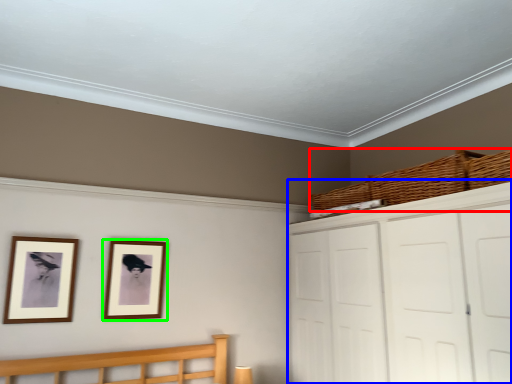
Question: Considering the real-world distances, which object is closest to basket (highlighted by a red box)? dresser (highlighted by a blue box) or picture frame (highlighted by a green box).

Choices:
 (A) dresser
 (B) picture frame

Answer: (A)